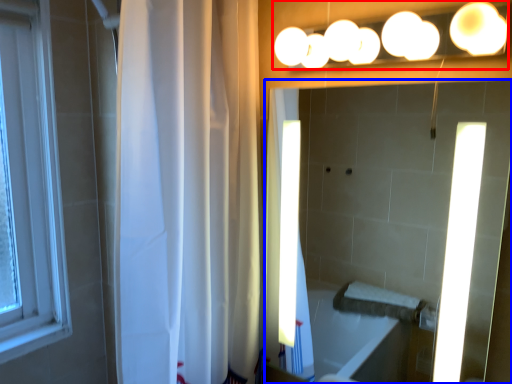
Question: Which of the following is the farthest to the observer, fixture (highlighted by a red box) or mirror (highlighted by a blue box)?

Choices:
 (A) fixture
 (B) mirror

Answer: (B)